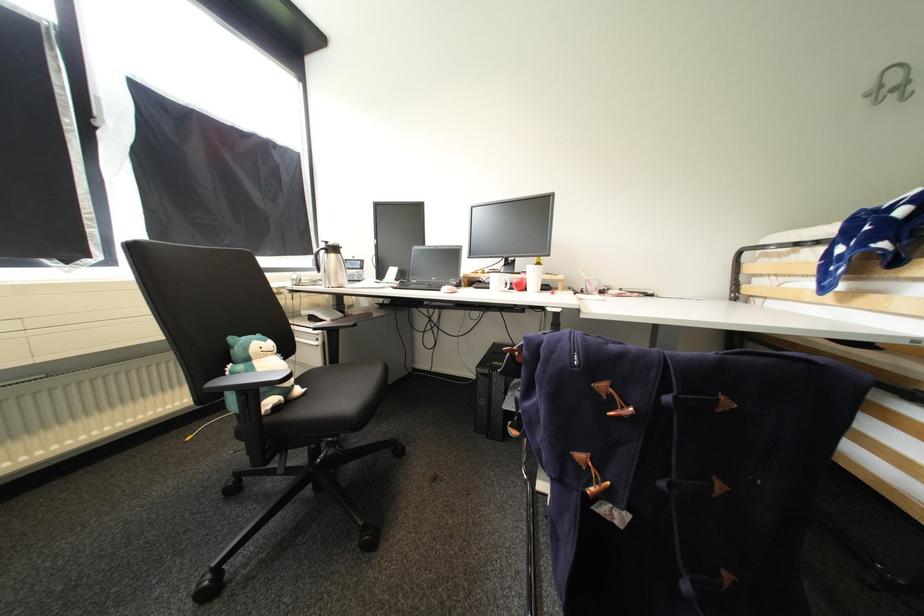
Where would you hang the silver wall hook? Please return your answer as a coordinate pair (x, y).

(891, 84)